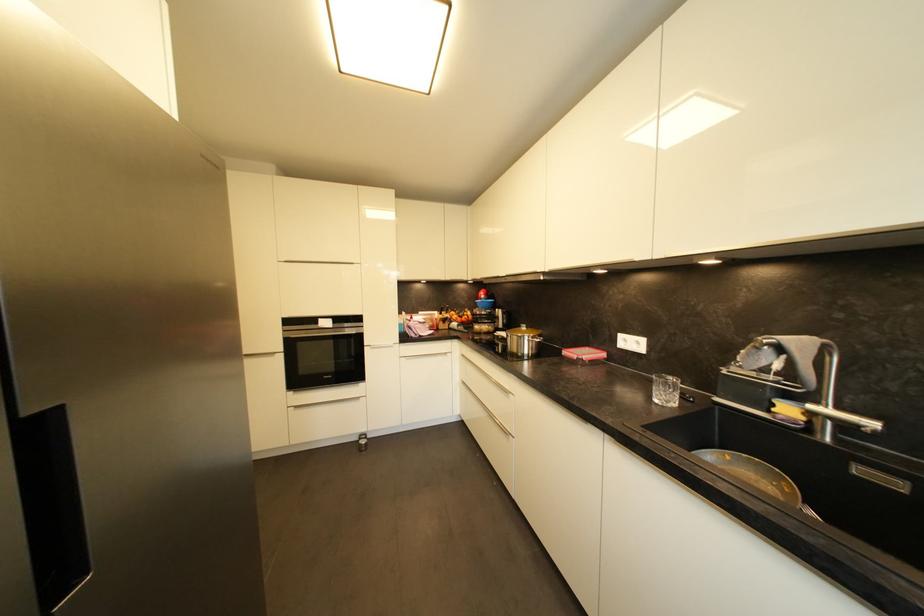
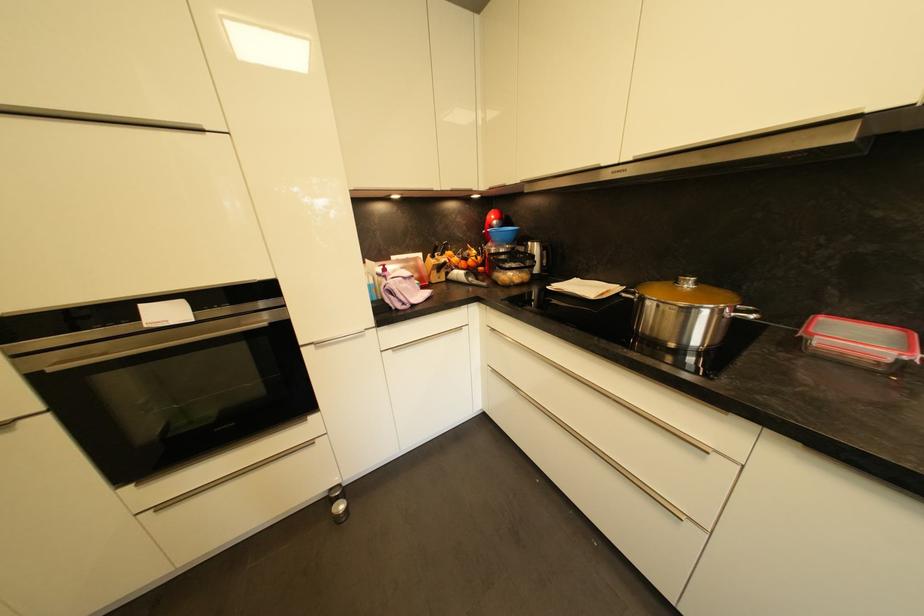
Where in the second image is the point corresponding to point (529, 330) from the first image?

(694, 286)